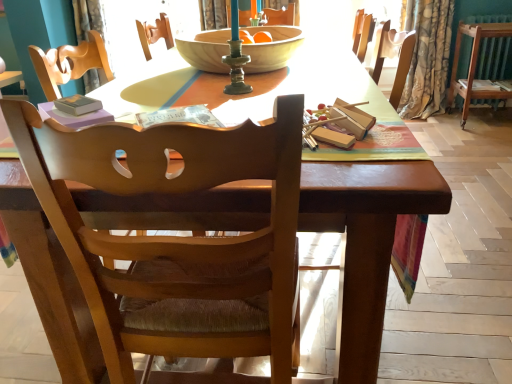
The width and height of the screenshot is (512, 384). In order to click on free point to the right of green metallic candle holder at center in this screenshot , I will do coord(301,84).